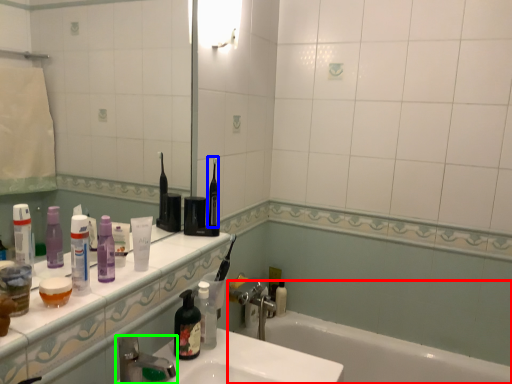
Question: Which object is the closest to the bathtub (highlighted by a red box)? Choose among these: toothbrush (highlighted by a blue box) or tap (highlighted by a green box).

Choices:
 (A) toothbrush
 (B) tap

Answer: (A)